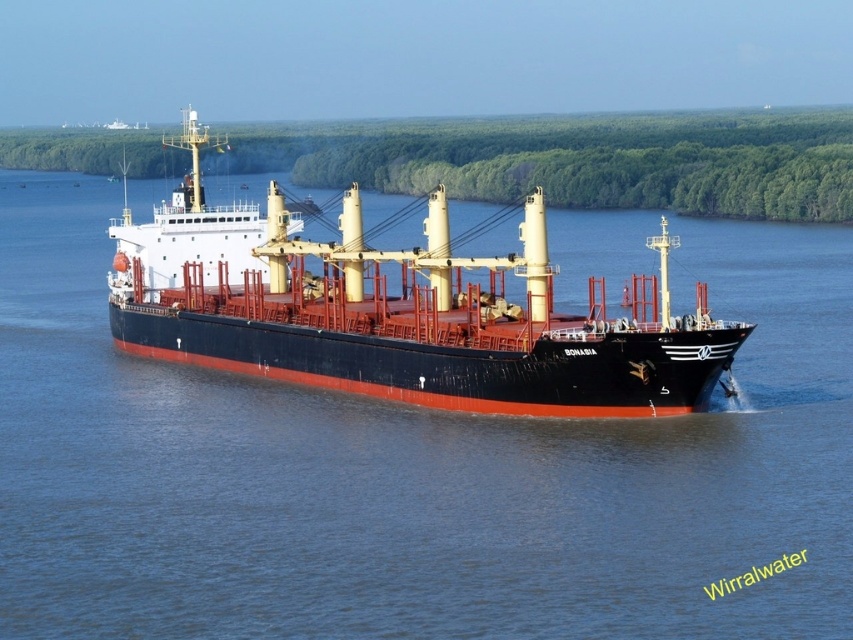
You are standing on the deck of the BONASIA cargo ship and looking out towards the water. There is a point marked at coordinates (x=413, y=472). What is located at that point?

The point at coordinates (x=413, y=472) indicates blue water at center.

You are a sailor on the deck of the black matte cargo ship at center. You notice the blue water at center below you. Can you confirm if the water is directly beneath the ship?

The blue water at center is positioned under the black matte cargo ship at center, so yes, the water is directly beneath the ship.